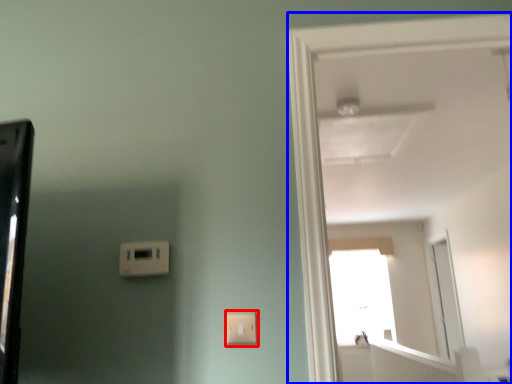
Question: Which object is further to the camera taking this photo, light switch (highlighted by a red box) or door (highlighted by a blue box)?

Choices:
 (A) light switch
 (B) door

Answer: (A)